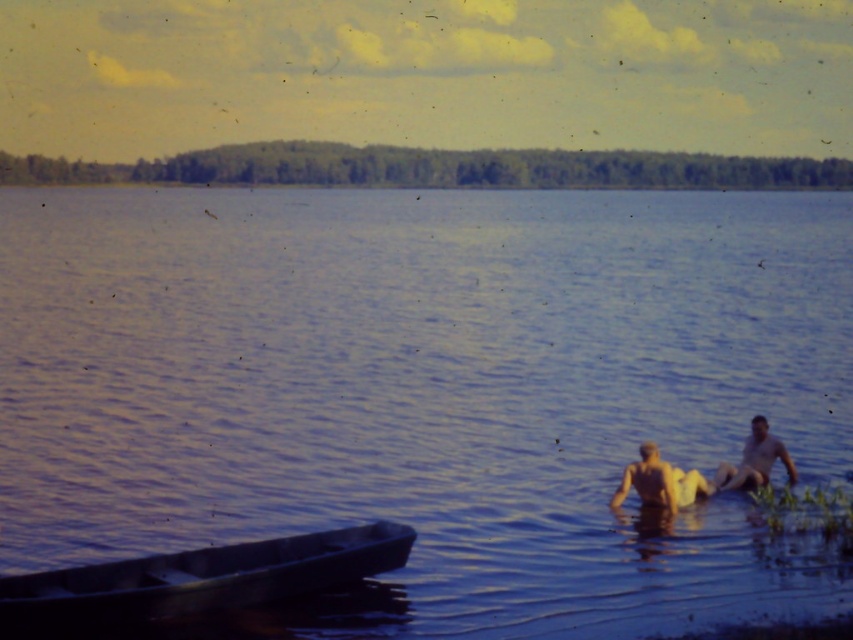
Question: Which object is farther from the camera taking this photo?

Choices:
 (A) blue water at center
 (B) dark gray metallic boat at lower left
 (C) skinny yellow swimwear at lower right
 (D) smooth skin person at lower right

Answer: (D)

Question: Which object appears farthest from the camera in this image?

Choices:
 (A) smooth skin person at lower right
 (B) skinny yellow swimwear at lower right

Answer: (A)

Question: Is blue water at center above skinny yellow swimwear at lower right?

Choices:
 (A) no
 (B) yes

Answer: (B)

Question: Does skinny yellow swimwear at lower right have a smaller size compared to smooth skin person at lower right?

Choices:
 (A) no
 (B) yes

Answer: (A)

Question: From the image, what is the correct spatial relationship of blue water at center in relation to smooth skin person at lower right?

Choices:
 (A) below
 (B) above

Answer: (B)

Question: Which object appears farthest from the camera in this image?

Choices:
 (A) smooth skin person at lower right
 (B) dark gray metallic boat at lower left
 (C) blue water at center
 (D) skinny yellow swimwear at lower right

Answer: (A)